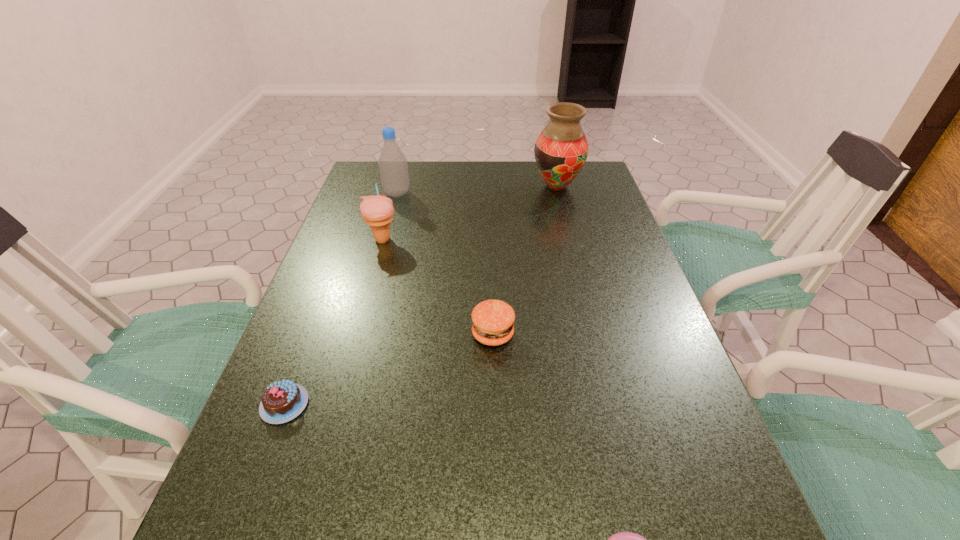
Identify the location of vase. (561, 150).

Locate an element on the screen. This screenshot has height=540, width=960. bottle is located at coordinates (393, 167).

Where is `the fourth nearest object`? the fourth nearest object is located at coordinates (377, 211).

Identify the location of icecream. (377, 211).

Where is `the fourth tallest object`? This screenshot has height=540, width=960. the fourth tallest object is located at coordinates (493, 320).

Locate an element on the screen. the third nearest object is located at coordinates (493, 320).

Locate an element on the screen. the second shortest object is located at coordinates (282, 401).

Image resolution: width=960 pixels, height=540 pixels. Identify the location of the leftmost object. (282, 401).

You are a GUI agent. You are given a task and a screenshot of the screen. Output one action in this format:
    pyautogui.click(x=<x>, y=<y>)
    Task: Click on the free spot located on the left of the vase
    The height and width of the screenshot is (540, 960).
    Given the screenshot: What is the action you would take?
    pyautogui.click(x=462, y=186)

The width and height of the screenshot is (960, 540). Find the location of `vacant space located 0.130m on the front of the bottle`. vacant space located 0.130m on the front of the bottle is located at coordinates (389, 224).